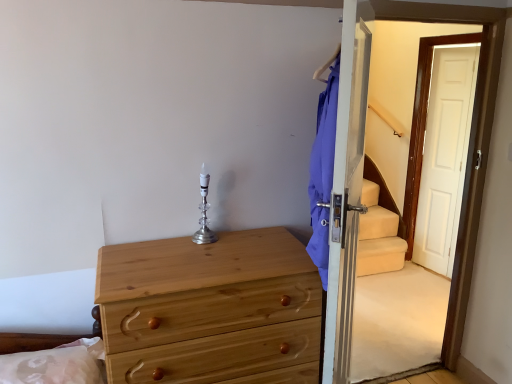
Question: Is silver/crystal candle holder at center turned away from silky white pillow at lower left?

Choices:
 (A) no
 (B) yes

Answer: (A)

Question: Is there a large distance between silver/crystal candle holder at center and silky white pillow at lower left?

Choices:
 (A) no
 (B) yes

Answer: (A)

Question: Is silver/crystal candle holder at center placed right next to silky white pillow at lower left?

Choices:
 (A) yes
 (B) no

Answer: (B)

Question: Is silver/crystal candle holder at center to the left of silky white pillow at lower left from the viewer's perspective?

Choices:
 (A) no
 (B) yes

Answer: (A)

Question: Does silver/crystal candle holder at center have a greater height compared to silky white pillow at lower left?

Choices:
 (A) no
 (B) yes

Answer: (B)

Question: From the image's perspective, is silver/crystal candle holder at center beneath silky white pillow at lower left?

Choices:
 (A) no
 (B) yes

Answer: (A)

Question: Are transparent glass screen door at right and natural wood chest of drawers at lower left making contact?

Choices:
 (A) no
 (B) yes

Answer: (A)

Question: Does transparent glass screen door at right lie behind natural wood chest of drawers at lower left?

Choices:
 (A) yes
 (B) no

Answer: (B)

Question: Does transparent glass screen door at right appear on the left side of natural wood chest of drawers at lower left?

Choices:
 (A) yes
 (B) no

Answer: (B)

Question: Is transparent glass screen door at right far away from natural wood chest of drawers at lower left?

Choices:
 (A) no
 (B) yes

Answer: (B)

Question: From the image's perspective, is transparent glass screen door at right located beneath natural wood chest of drawers at lower left?

Choices:
 (A) no
 (B) yes

Answer: (A)

Question: Is transparent glass screen door at right facing away from natural wood chest of drawers at lower left?

Choices:
 (A) yes
 (B) no

Answer: (A)

Question: Is silver/crystal candle holder at center inside natural wood chest of drawers at lower left?

Choices:
 (A) yes
 (B) no

Answer: (B)